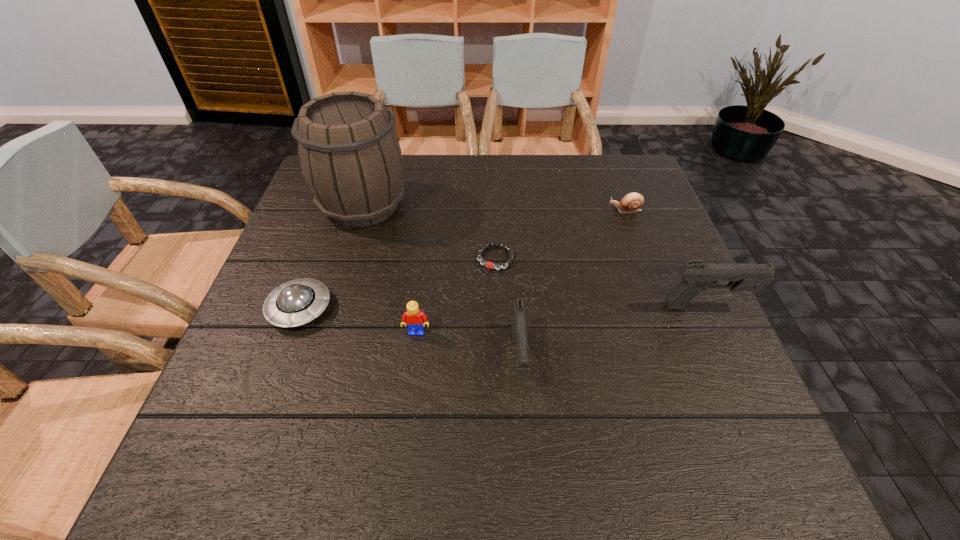
I want to click on the third object from left to right, so click(414, 318).

Identify the location of vacant space located 0.250m on the left of the fifth nearest object. The height and width of the screenshot is (540, 960). (372, 258).

You are a GUI agent. You are given a task and a screenshot of the screen. Output one action in this format:
    pyautogui.click(x=<x>, y=<y>)
    Task: Click on the free region located on the front of the tallest object
    
    Given the screenshot: What is the action you would take?
    pyautogui.click(x=322, y=342)

Where is `vacant space located 0.150m on the front-facing side of the escargot`? The image size is (960, 540). vacant space located 0.150m on the front-facing side of the escargot is located at coordinates (553, 210).

This screenshot has width=960, height=540. I want to click on vacant space located on the front-facing side of the escargot, so click(526, 210).

Locate an element on the screen. Image resolution: width=960 pixels, height=540 pixels. vacant space situated 0.200m on the front-facing side of the escargot is located at coordinates (534, 210).

Find the location of a particular element. Image resolution: width=960 pixels, height=540 pixels. vacant space located on the back of the saucer is located at coordinates (325, 239).

The width and height of the screenshot is (960, 540). What are the coordinates of `vacant space located on the front-facing side of the fourth shortest object` in the screenshot? It's located at (412, 375).

At what (x,y) coordinates should I click in order to perform the action: click on object that is positioned at the far edge. Please return your answer as a coordinate pair (x, y). Looking at the image, I should click on (349, 153).

Where is `object present at the near edge`? The width and height of the screenshot is (960, 540). object present at the near edge is located at coordinates (519, 330).